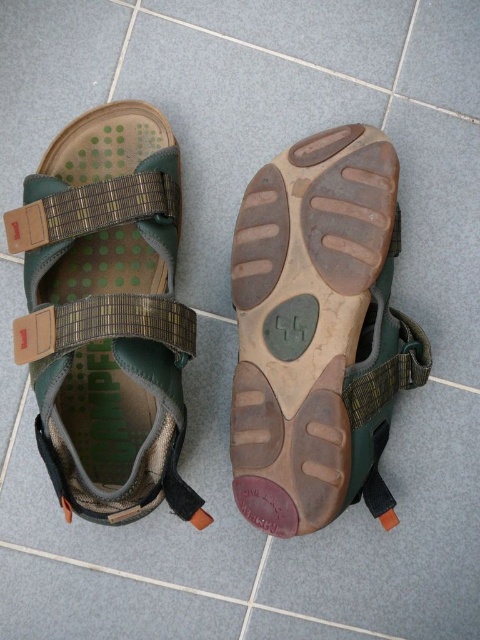
You are trying to choose between the brown rubber sandal at center and the green fabric sandal at center for your hike. Which sandal has a shorter length?

The brown rubber sandal at center is shorter than the green fabric sandal at center, so the brown one is shorter.

You are standing in a room with the hiking sandals in front of you. You need to put on the brown rubber sandal at center and the green fabric sandal at center. Which sandal should you put on first based on their position?

You should put on the green fabric sandal at center first because the brown rubber sandal at center is to the right of it, so the green fabric sandal at center is on the left side and closer to your left hand when standing in front.

You are organizing a shoe rack and need to place the brown rubber sandal at center and the green fabric sandal at center. Since the rack has limited vertical space, which sandal should you place on top to ensure both fit?

The brown rubber sandal at center is located below green fabric sandal at center, so to fit both on the rack with limited vertical space, place the green fabric sandal at center on top of the brown rubber sandal at center.